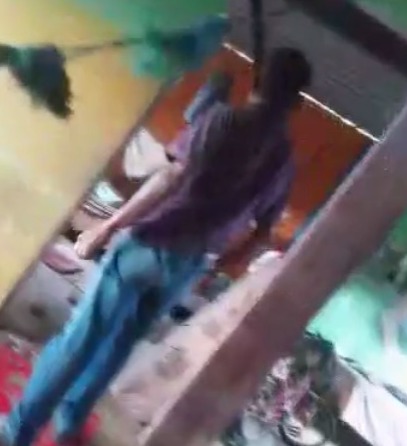
Identify the location of bed. This screenshot has width=407, height=446. (378, 403).